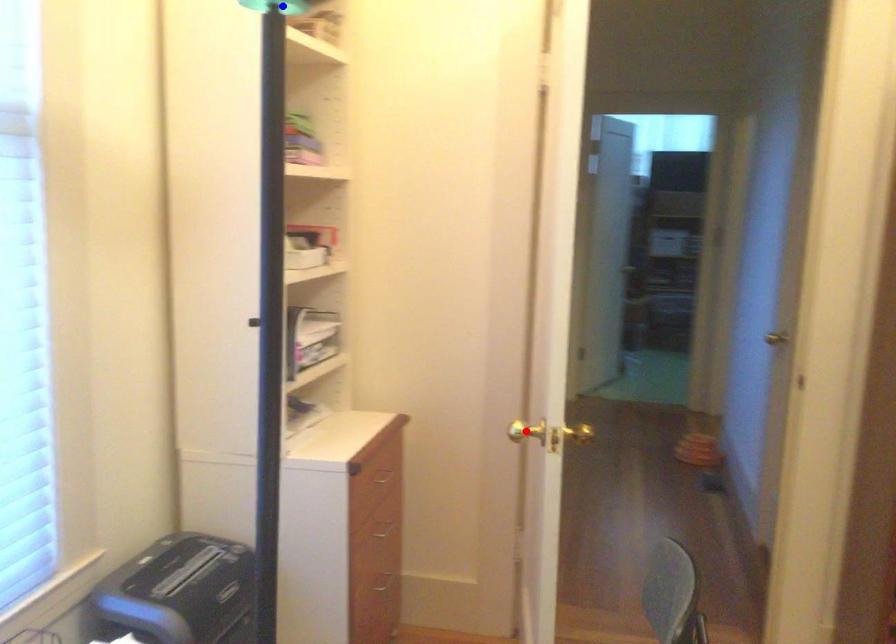
Question: Two points are marked on the image. Which point is closer to the camera?

Choices:
 (A) Blue point is closer.
 (B) Red point is closer.

Answer: (B)